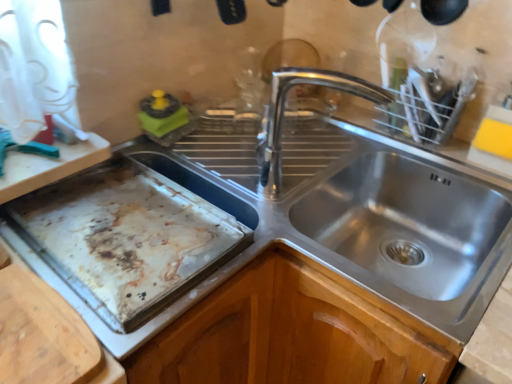
Question: Is stained aluminum baking sheet at left wider than stainless steel sink at center?

Choices:
 (A) yes
 (B) no

Answer: (B)

Question: Are stained aluminum baking sheet at left and stainless steel sink at center beside each other?

Choices:
 (A) yes
 (B) no

Answer: (B)

Question: Is stained aluminum baking sheet at left to the right of stainless steel sink at center from the viewer's perspective?

Choices:
 (A) no
 (B) yes

Answer: (A)

Question: Can you confirm if stained aluminum baking sheet at left is bigger than stainless steel sink at center?

Choices:
 (A) no
 (B) yes

Answer: (A)

Question: From the image's perspective, is stained aluminum baking sheet at left on top of stainless steel sink at center?

Choices:
 (A) no
 (B) yes

Answer: (B)

Question: Does point (274, 142) appear closer or farther from the camera than point (133, 322)?

Choices:
 (A) farther
 (B) closer

Answer: (A)

Question: In terms of height, does polished metal tap at center look taller or shorter compared to stained aluminum baking sheet at left?

Choices:
 (A) tall
 (B) short

Answer: (A)

Question: Relative to stained aluminum baking sheet at left, is polished metal tap at center in front or behind?

Choices:
 (A) front
 (B) behind

Answer: (B)

Question: From the image's perspective, is polished metal tap at center located above or below stained aluminum baking sheet at left?

Choices:
 (A) below
 (B) above

Answer: (B)

Question: Considering the positions of point click(x=268, y=142) and point click(x=443, y=276), is point click(x=268, y=142) closer or farther from the camera than point click(x=443, y=276)?

Choices:
 (A) farther
 (B) closer

Answer: (B)

Question: From a real-world perspective, relative to stainless steel sink at center, is polished metal tap at center vertically above or below?

Choices:
 (A) below
 (B) above

Answer: (B)

Question: From the image's perspective, is polished metal tap at center above or below stainless steel sink at center?

Choices:
 (A) above
 (B) below

Answer: (A)

Question: Based on their positions, is polished metal tap at center located to the left or right of stainless steel sink at center?

Choices:
 (A) left
 (B) right

Answer: (A)

Question: Considering the positions of stained aluminum baking sheet at left and polished metal tap at center in the image, is stained aluminum baking sheet at left bigger or smaller than polished metal tap at center?

Choices:
 (A) small
 (B) big

Answer: (A)

Question: From the image's perspective, relative to polished metal tap at center, is stained aluminum baking sheet at left above or below?

Choices:
 (A) below
 (B) above

Answer: (A)